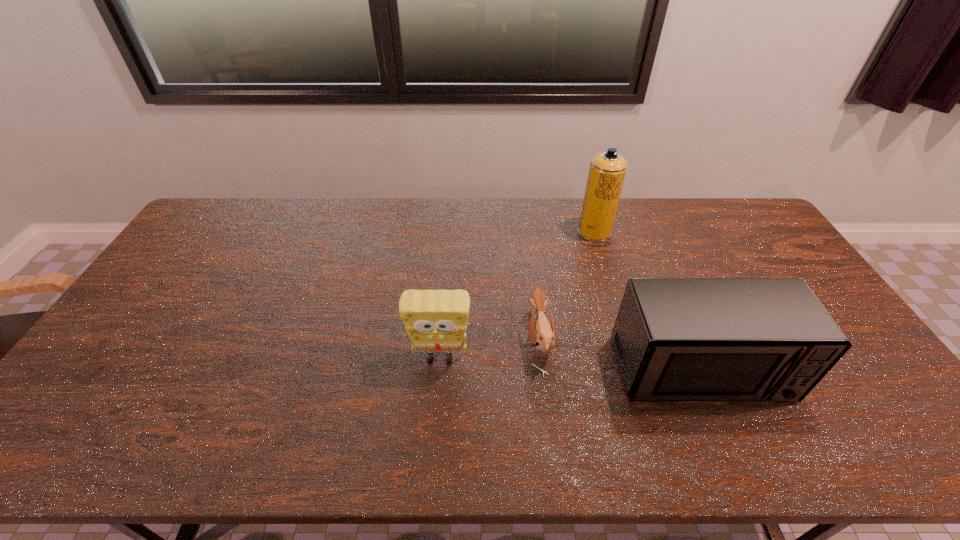
At what (x,y) coordinates should I click in order to perform the action: click on the tallest object. Please return your answer as a coordinate pair (x, y). Image resolution: width=960 pixels, height=540 pixels. Looking at the image, I should click on (607, 171).

Image resolution: width=960 pixels, height=540 pixels. I want to click on the farthest object, so click(607, 171).

The image size is (960, 540). I want to click on microwave_oven, so click(x=675, y=339).

The width and height of the screenshot is (960, 540). In order to click on sponge in this screenshot , I will do `click(436, 320)`.

Where is `bird`? bird is located at coordinates (542, 334).

At what (x,y) coordinates should I click in order to perform the action: click on the second object from left to right. Please return your answer as a coordinate pair (x, y). The image size is (960, 540). Looking at the image, I should click on (542, 334).

In order to click on vacant space located 0.290m on the right of the aerosol can in this screenshot , I will do `click(692, 232)`.

Where is `free space located 0.060m on the front-facing side of the microwave_oven`? free space located 0.060m on the front-facing side of the microwave_oven is located at coordinates (725, 430).

Locate an element on the screen. The height and width of the screenshot is (540, 960). vacant space located on the face of the sponge is located at coordinates (434, 434).

The image size is (960, 540). In order to click on vacant space located 0.320m at the beak of the second object from left to right in this screenshot , I will do `click(411, 341)`.